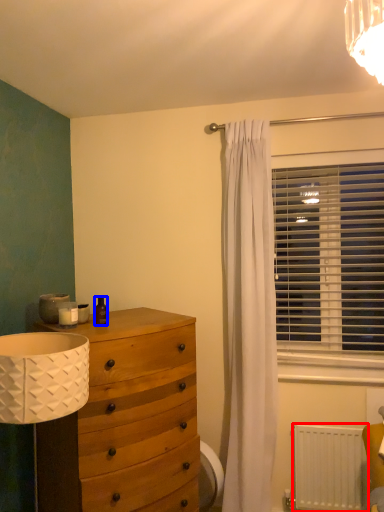
Question: Which point is further to the camera, radiator (highlighted by a red box) or toiletry (highlighted by a blue box)?

Choices:
 (A) radiator
 (B) toiletry

Answer: (A)